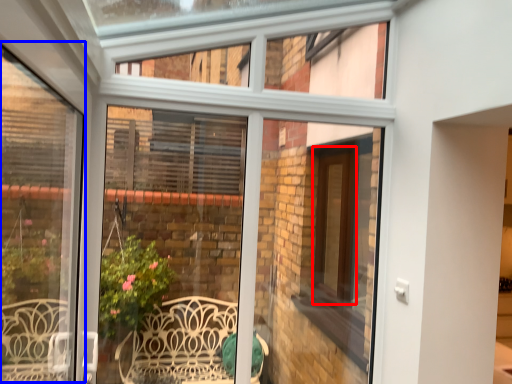
Question: Which object appears closest to the camera in this image, screen door (highlighted by a red box) or window frame (highlighted by a blue box)?

Choices:
 (A) screen door
 (B) window frame

Answer: (B)